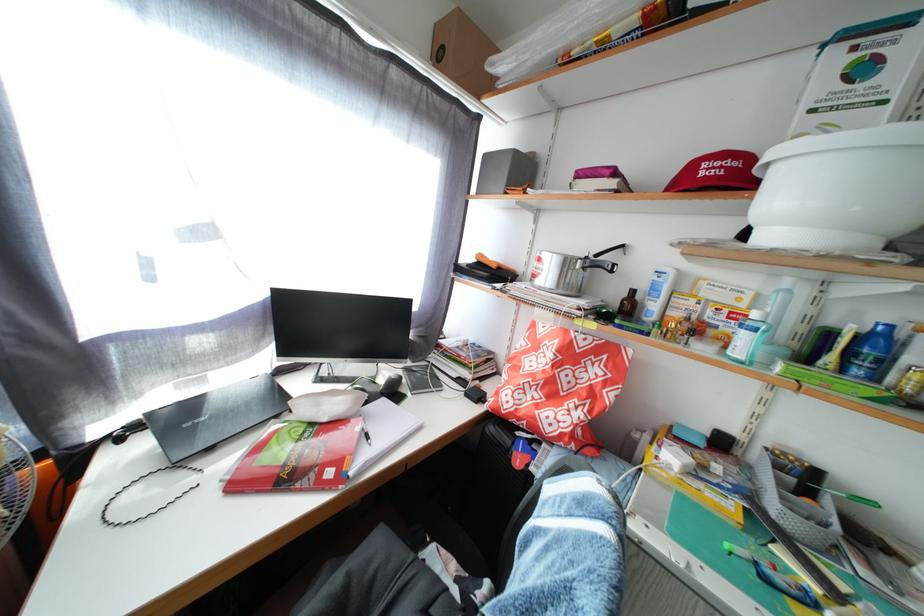
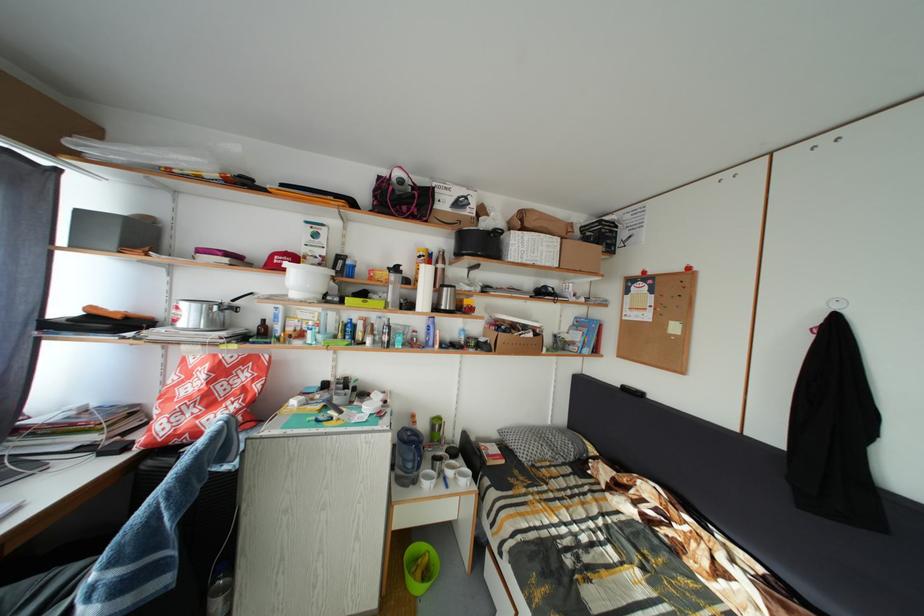
Question: The first image is from the beginning of the video and the second image is from the end. How did the camera likely rotate when shooting the video?

Choices:
 (A) Left
 (B) Right
 (C) Up
 (D) Down

Answer: (B)